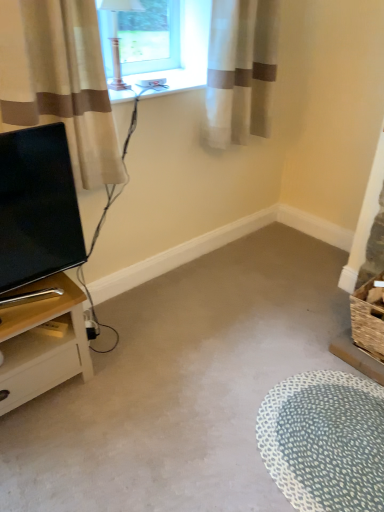
Where is `free point below matte black tv at left (from a real-world perspective)`? Image resolution: width=384 pixels, height=512 pixels. free point below matte black tv at left (from a real-world perspective) is located at coordinates (44, 294).